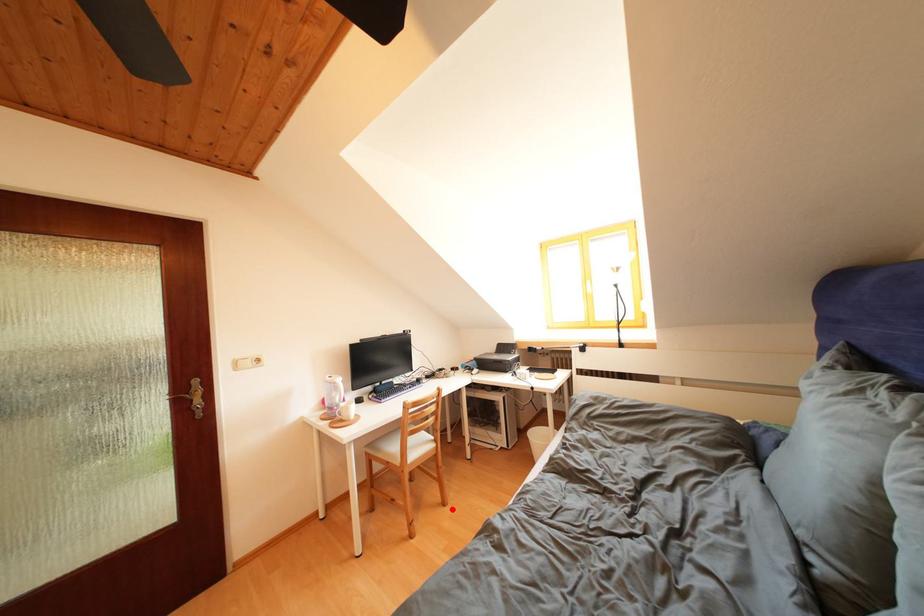
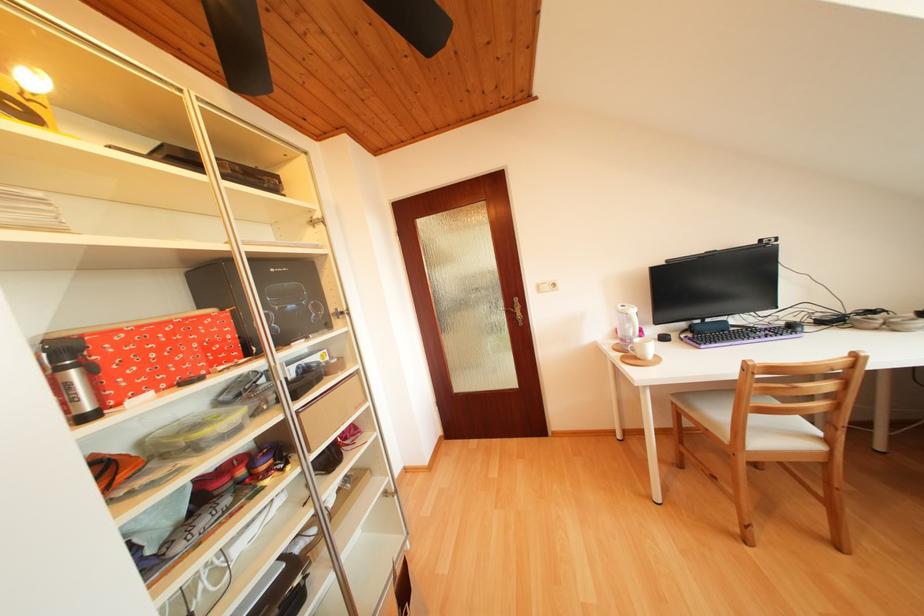
Question: A red point is marked in image1. In image2, is the corresponding 3D point closer to the camera or farther? Reply with the corresponding letter.

Choices:
 (A) The corresponding 3D point is closer.
 (B) The corresponding 3D point is farther.

Answer: (B)